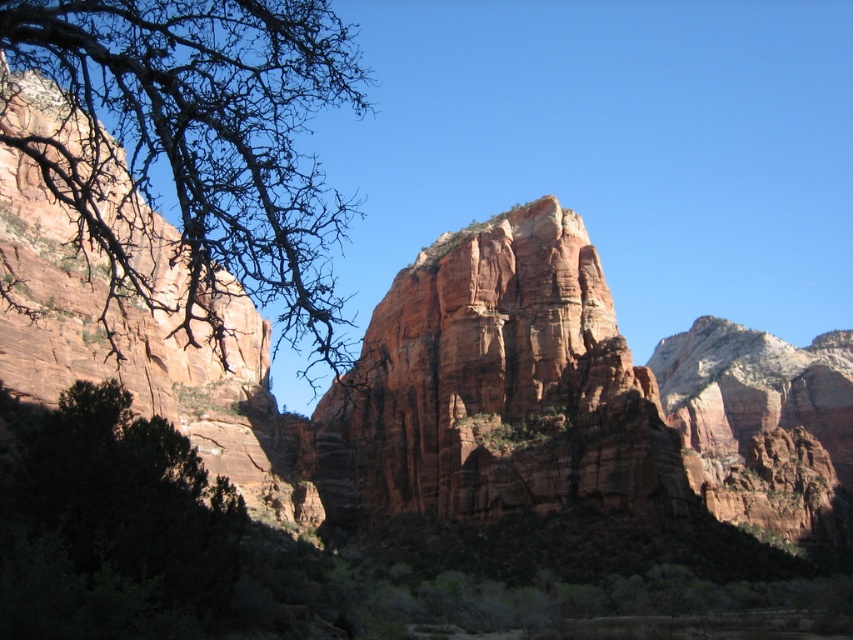
Does reddish-brown sandstone cliff at center have a smaller size compared to dark green leafy tree at lower left?

Incorrect, reddish-brown sandstone cliff at center is not smaller in size than dark green leafy tree at lower left.

Does reddish-brown sandstone cliff at center have a greater width compared to dark green leafy tree at lower left?

Indeed, reddish-brown sandstone cliff at center has a greater width compared to dark green leafy tree at lower left.

At what (x,y) coordinates should I click in order to perform the action: click on reddish-brown sandstone cliff at center. Please return your answer as a coordinate pair (x, y). The width and height of the screenshot is (853, 640). Looking at the image, I should click on (502, 385).

I want to click on reddish-brown sandstone cliff at center, so click(502, 385).

Can you confirm if bare branches at left is smaller than dark green leafy tree at lower left?

No.

Which is behind, point (122, 54) or point (155, 554)?

The point (155, 554) is behind.

Locate an element on the screen. This screenshot has height=640, width=853. bare branches at left is located at coordinates (200, 140).

Does point (321, 173) lie in front of point (461, 308)?

No, (321, 173) is behind (461, 308).

Can you confirm if bare branches at left is shorter than reddish-brown sandstone cliff at center?

Incorrect, bare branches at left's height does not fall short of reddish-brown sandstone cliff at center's.

Identify the location of bare branches at left. The height and width of the screenshot is (640, 853). (200, 140).